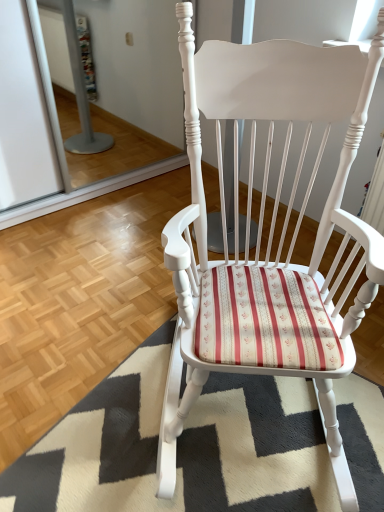
Where is `free space underneath white painted wood rocking chair at center (from a real-world perspective)`? This screenshot has height=512, width=384. free space underneath white painted wood rocking chair at center (from a real-world perspective) is located at coordinates (255, 416).